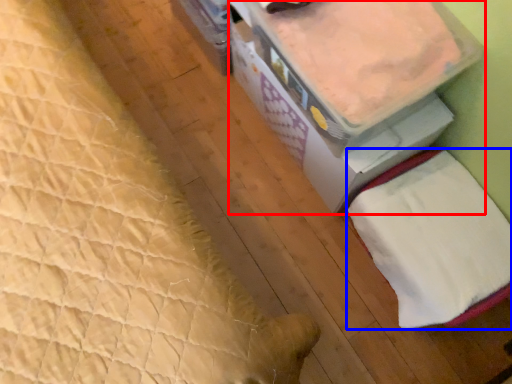
Question: Which object appears farthest to the camera in this image, storage box (highlighted by a red box) or sheet (highlighted by a blue box)?

Choices:
 (A) storage box
 (B) sheet

Answer: (B)